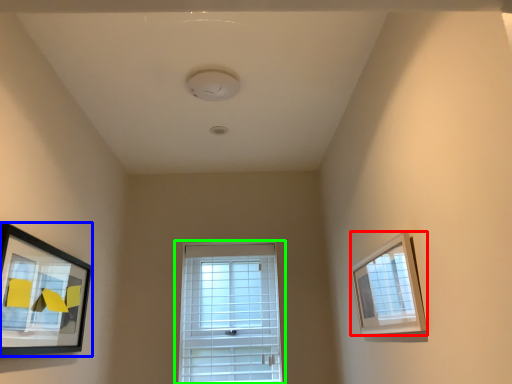
Question: Which is nearer to the picture frame (highlighted by a red box)? picture frame (highlighted by a blue box) or window (highlighted by a green box).

Choices:
 (A) picture frame
 (B) window

Answer: (A)